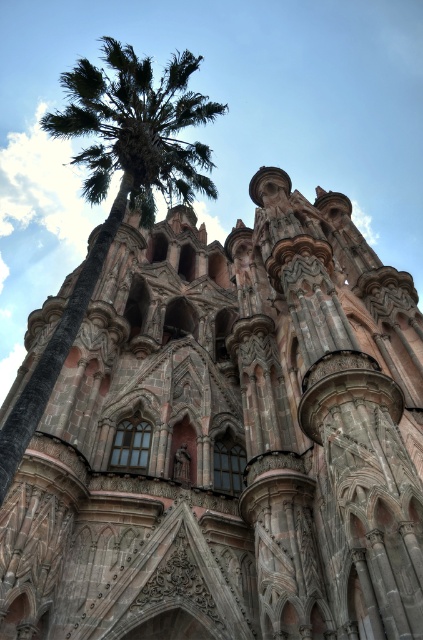
Does carved stone church at center have a larger size compared to green leafy palm tree at left?

Actually, carved stone church at center might be smaller than green leafy palm tree at left.

At what (x,y) coordinates should I click in order to perform the action: click on carved stone church at center. Please return your answer as a coordinate pair (x, y). Looking at the image, I should click on (228, 440).

Who is more forward, [291,490] or [36,397]?

Point [36,397] is in front.

The height and width of the screenshot is (640, 423). Find the location of `carved stone church at center`. carved stone church at center is located at coordinates (228, 440).